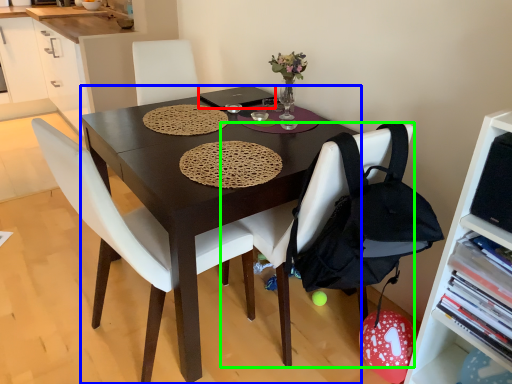
Question: Which object is positioned closest to laptop (highlighted by a red box)? Select from desk (highlighted by a blue box) and chair (highlighted by a green box).

Choices:
 (A) desk
 (B) chair

Answer: (A)